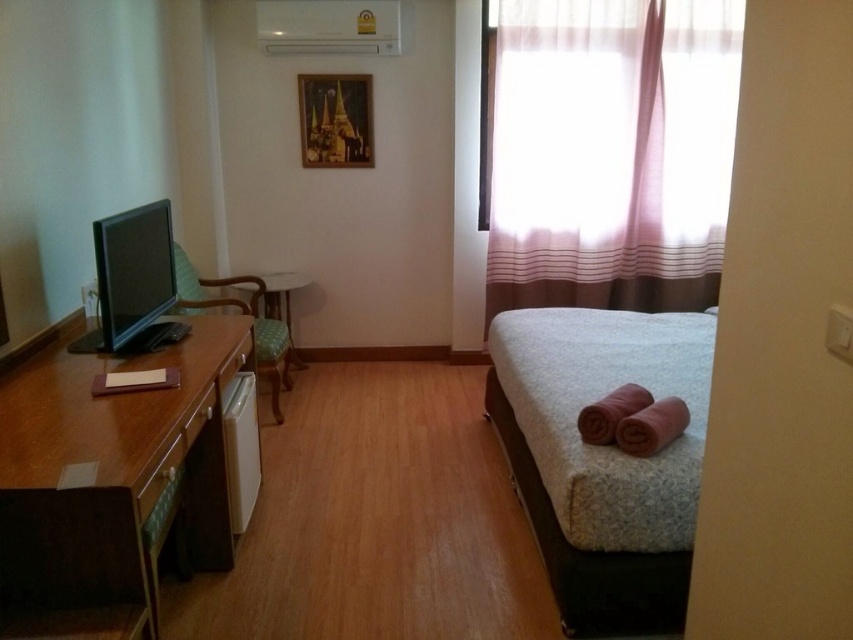
Question: Is matte green chair at left to the right of green fabric table at center from the viewer's perspective?

Choices:
 (A) no
 (B) yes

Answer: (A)

Question: Which object is positioned farthest from the sheer pink fabric at upper right?

Choices:
 (A) matte green chair at left
 (B) green fabric table at center

Answer: (A)

Question: Which point is farther to the camera?

Choices:
 (A) white textured bed at right
 (B) brown wood dresser at left
 (C) green fabric table at center

Answer: (C)

Question: Does sheer pink fabric at upper right have a smaller size compared to green fabric table at center?

Choices:
 (A) no
 (B) yes

Answer: (A)

Question: Which point is farther from the camera taking this photo?

Choices:
 (A) (277, 344)
 (B) (560, 128)
 (C) (637, 500)
 (D) (273, 291)

Answer: (B)

Question: Does brown wood dresser at left appear over matte green chair at left?

Choices:
 (A) no
 (B) yes

Answer: (A)